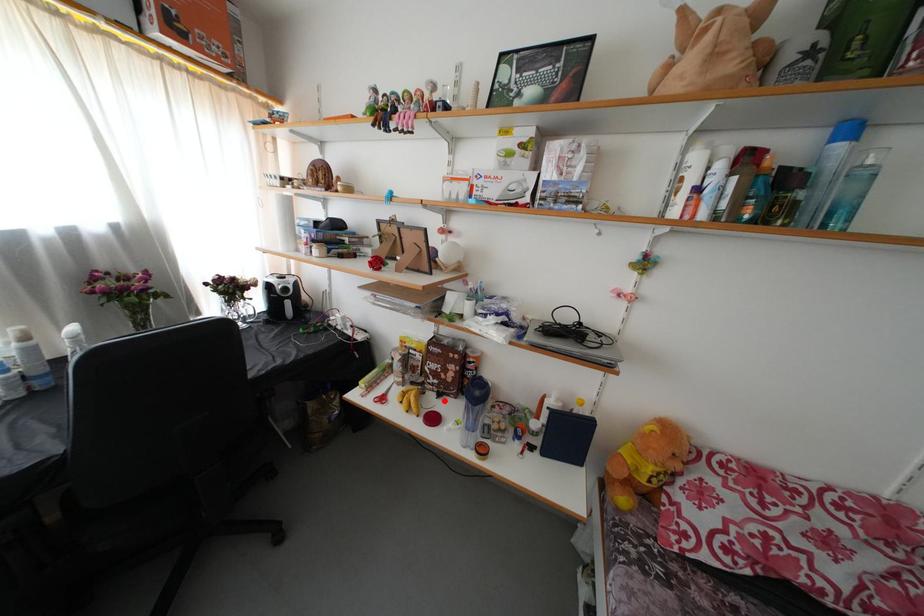
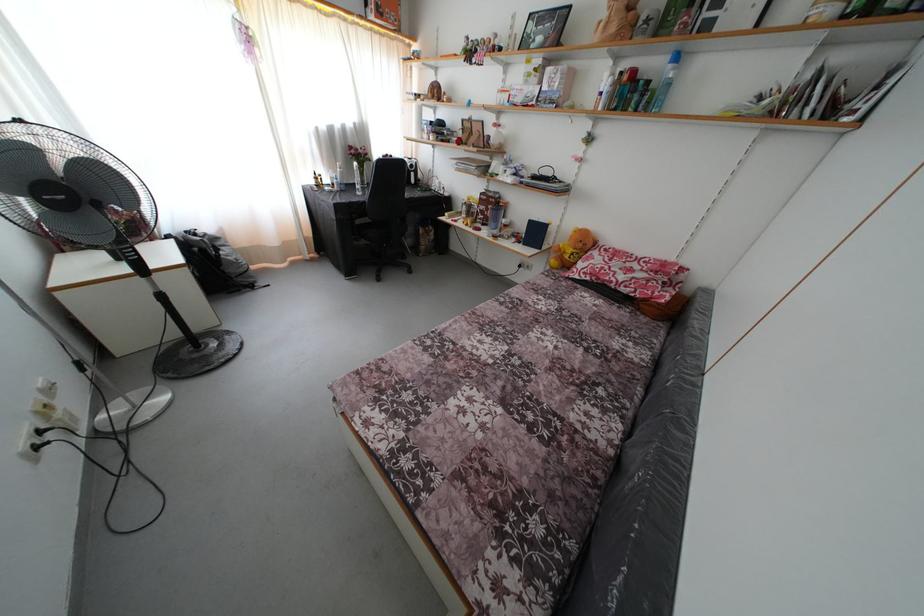
Find the pixel in the second image that matches the highlighted location in the first image.

(488, 230)